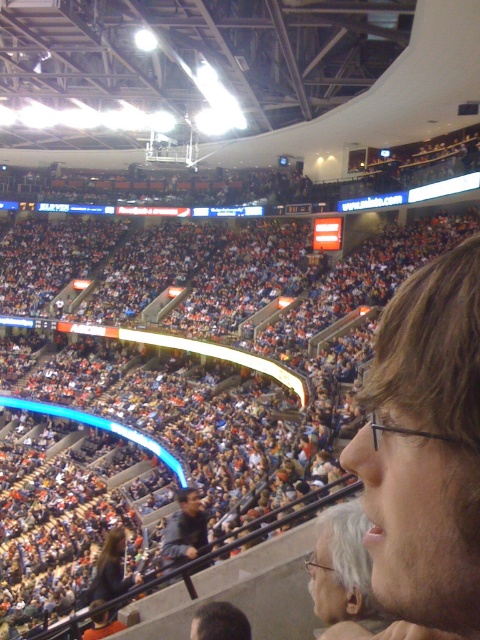
Question: Can you confirm if light brown hair at right is positioned to the right of dark gray jacket at center?

Choices:
 (A) yes
 (B) no

Answer: (A)

Question: Which point is closer to the camera taking this photo?

Choices:
 (A) (460, 268)
 (B) (188, 497)

Answer: (A)

Question: Is light brown hair at right thinner than dark gray jacket at center?

Choices:
 (A) no
 (B) yes

Answer: (B)

Question: Does light brown hair at right appear on the left side of dark gray jacket at center?

Choices:
 (A) no
 (B) yes

Answer: (A)

Question: Which of the following is the farthest from the observer?

Choices:
 (A) (195, 540)
 (B) (381, 412)

Answer: (A)